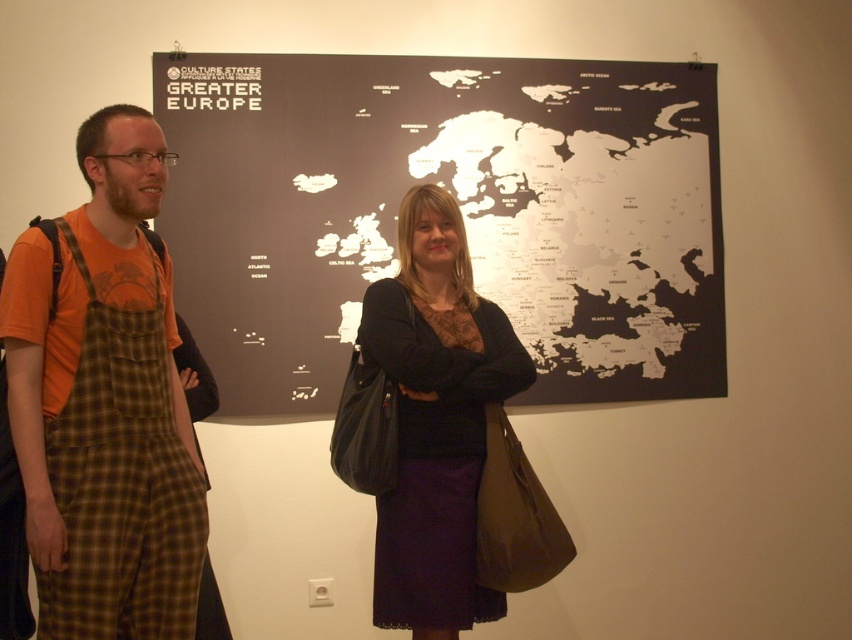
You are a tour guide explaining the map to a visitor. The visitor asks why the black matte map at center is positioned differently than the matte black dress at center. Based on the scene, how would you explain the spatial relationship between the two?

The black matte map at center is larger in size than the matte black dress at center, so it occupies more space and is positioned more prominently in the center of the scene compared to the dress.